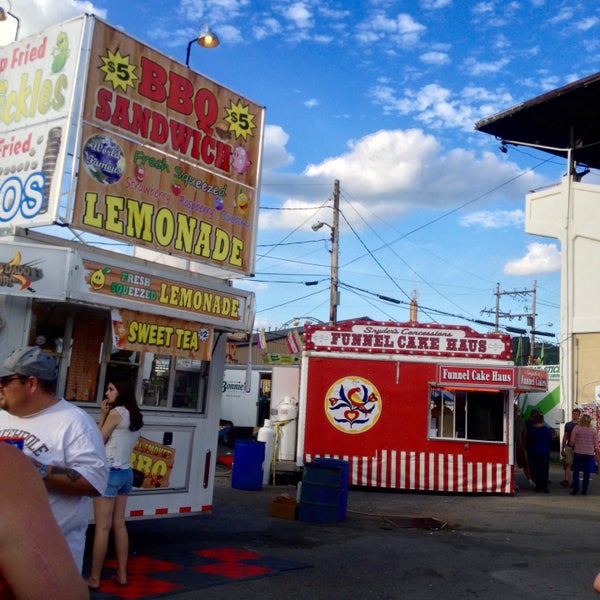
Image resolution: width=600 pixels, height=600 pixels. I want to click on funnerl cake stand, so click(x=406, y=394).